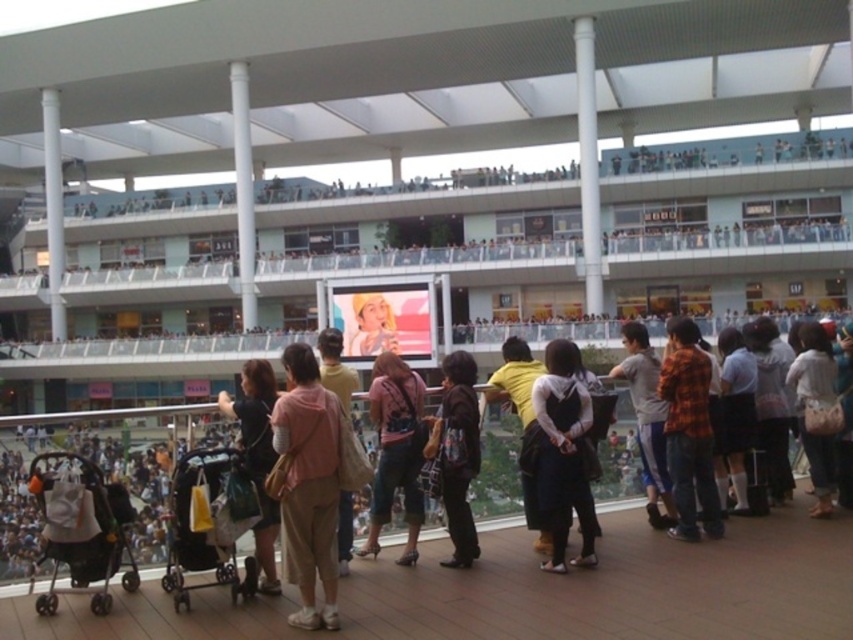
You are a photographer standing at the back of the wooden deck. You want to take a photo of the flannel shirt at center and the matte pink hoodie at center. Which clothing item will be partially blocked from view by the other?

The flannel shirt at center is not as tall as the matte pink hoodie at center, so the flannel shirt at center will be partially blocked by the matte pink hoodie at center.

You are a photographer standing on the wooden deck at the shopping mall. You notice two people wearing the flannel shirt at center and the matte pink hoodie at center. Which clothing item is positioned higher on the person?

The flannel shirt at center is above the matte pink hoodie at center, so the flannel shirt at center is positioned higher on the person.

You are standing on the wooden deck in the shopping mall and see a person wearing a pink fabric dress at center and gray fabric pants at center. Which clothing item is closer to the ground?

The pink fabric dress at center is below gray fabric pants at center, so the pink fabric dress at center is closer to the ground.